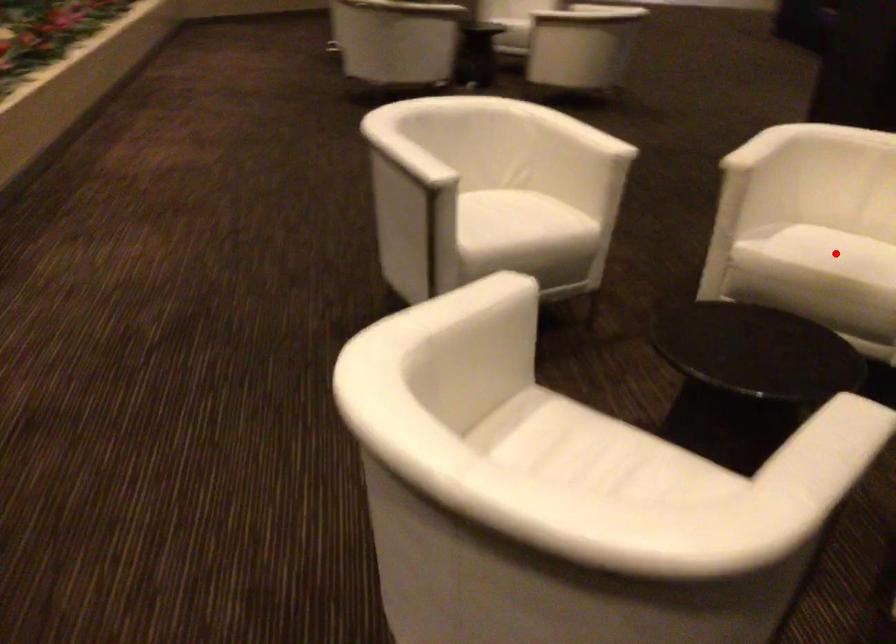
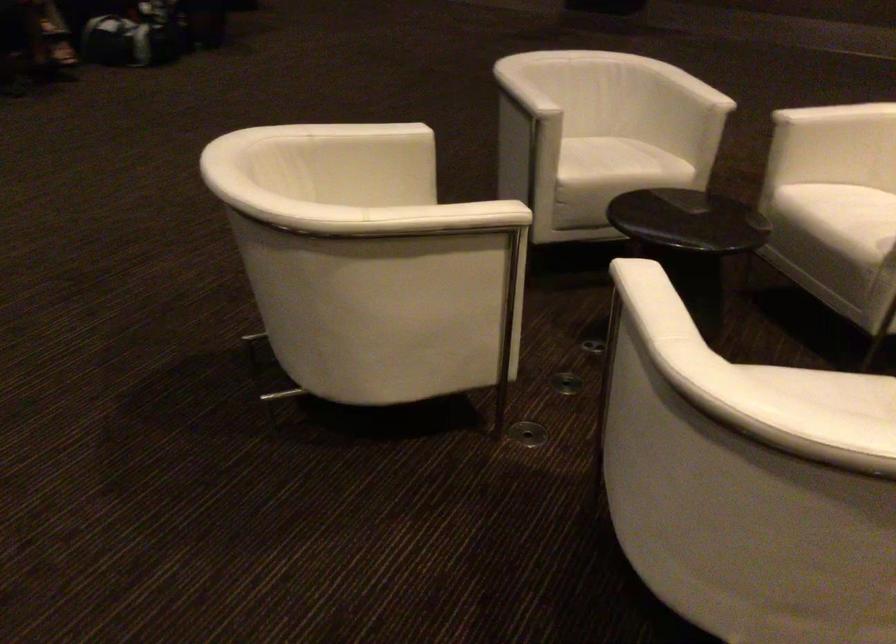
Question: I am providing you with two images of the same scene from different viewpoints. A red point is marked on the first image. Can you still see the location of the red point in image 2?

Choices:
 (A) Yes
 (B) No

Answer: (B)